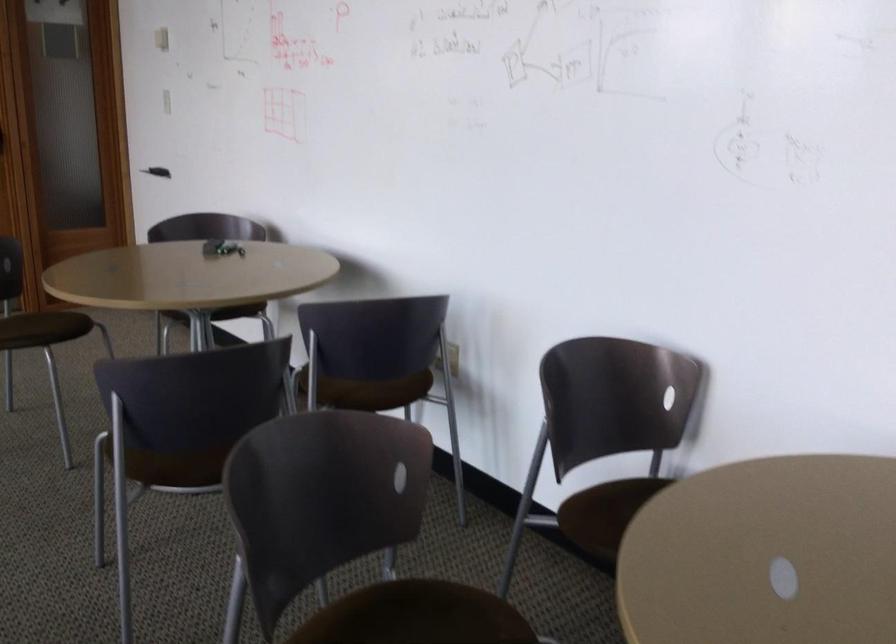
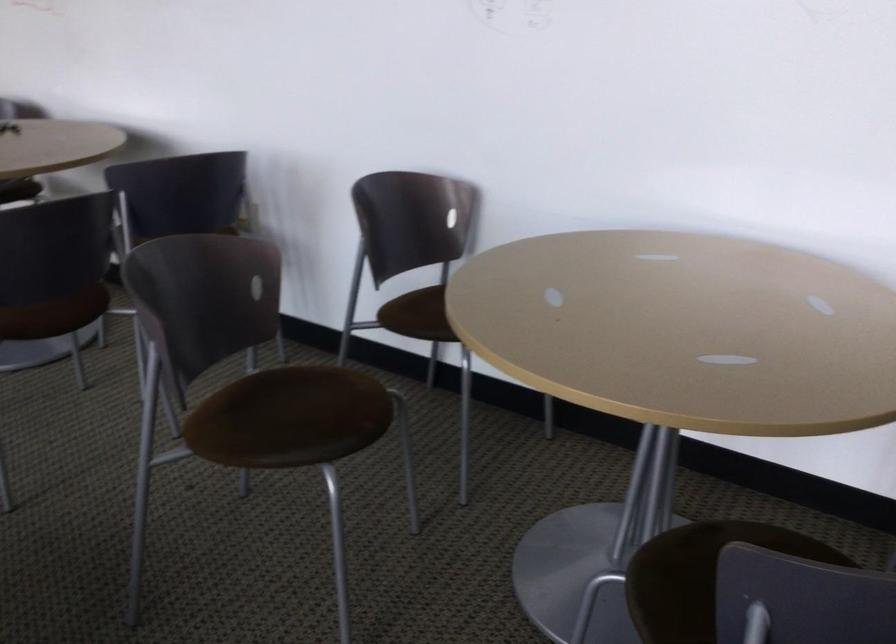
The images are taken continuously from a first-person perspective. In which direction are you moving?

The cameraman walked toward left, backward.